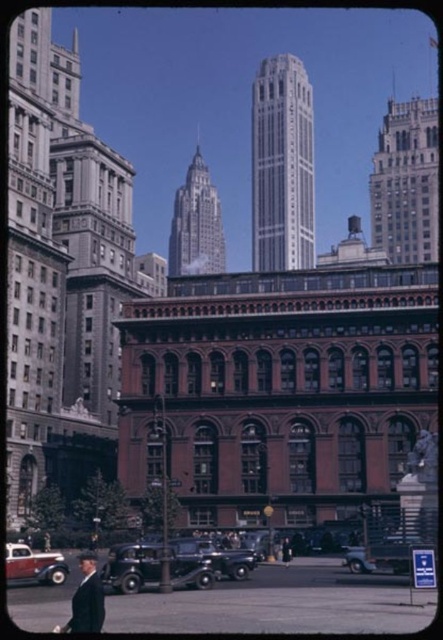
Between silver metallic skyscraper at center and matte red car at lower left, which one is positioned higher?

silver metallic skyscraper at center is above.

Between silver metallic skyscraper at center and matte red car at lower left, which one is positioned lower?

matte red car at lower left

Does point (203, 230) lie in front of point (49, 561)?

No, it is not.

At what (x,y) coordinates should I click in order to perform the action: click on silver metallic skyscraper at center. Please return your answer as a coordinate pair (x, y). The image size is (443, 640). Looking at the image, I should click on (195, 225).

Is shiny black car at lower center wider than matte red car at lower left?

No, shiny black car at lower center is not wider than matte red car at lower left.

Between point (124, 586) and point (37, 572), which one is positioned in front?

Point (124, 586) is in front.

Does point (124, 564) come closer to viewer compared to point (11, 544)?

Yes, point (124, 564) is closer to viewer.

I want to click on shiny black car at lower center, so click(132, 566).

Does point (111, 554) lie behind point (248, 576)?

No, (111, 554) is closer to viewer.

Which is in front, point (147, 544) or point (232, 576)?

Point (232, 576) is in front.

Where is `shiny black car at lower center`? The image size is (443, 640). shiny black car at lower center is located at coordinates (132, 566).